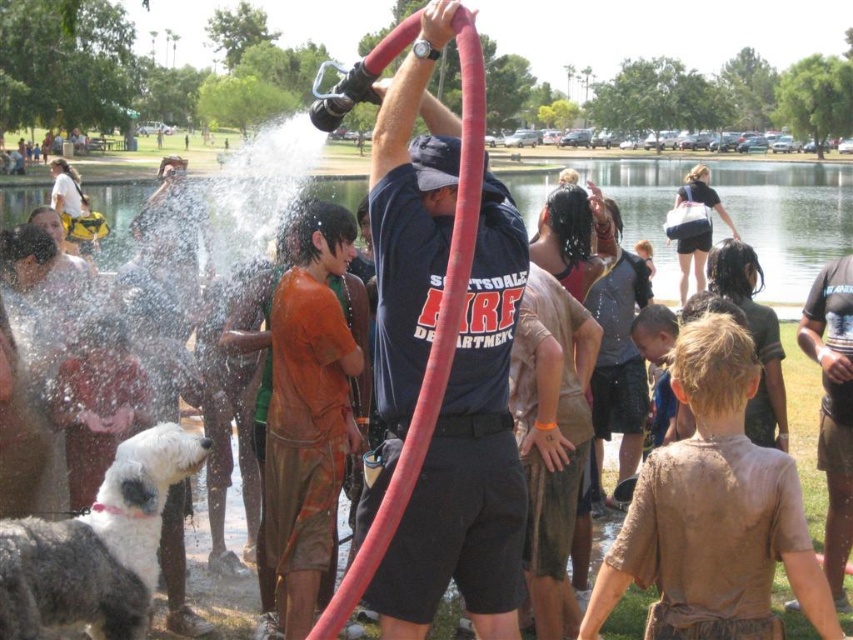
Between white foam water at center and dark brown t-shirt at right, which one is positioned higher?

white foam water at center is above.

Does white foam water at center appear on the right side of dark brown t-shirt at right?

Correct, you'll find white foam water at center to the right of dark brown t-shirt at right.

Locate an element on the screen. white foam water at center is located at coordinates (788, 218).

Does rubber hose at center appear on the left side of dark brown t-shirt at right?

Correct, you'll find rubber hose at center to the left of dark brown t-shirt at right.

Who is more distant from viewer, [381,64] or [849,529]?

The point [849,529] is behind.

Image resolution: width=853 pixels, height=640 pixels. In order to click on rubber hose at center in this screenshot , I will do `click(436, 332)`.

Who is shorter, white foam water at center or rubber hose at center?

Standing shorter between the two is white foam water at center.

Which is in front, point (775, 212) or point (346, 579)?

Point (346, 579) is in front.

Find the location of a particular element. This screenshot has width=853, height=640. white foam water at center is located at coordinates (788, 218).